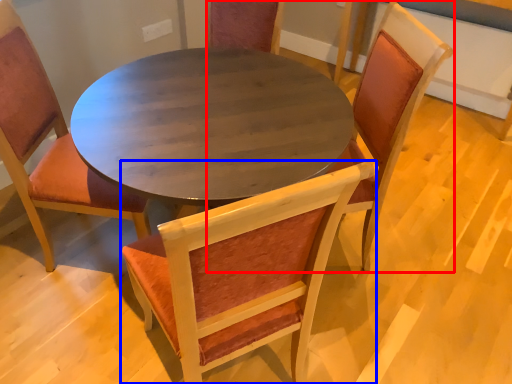
Question: Which of the following is the closest to the observer, chair (highlighted by a red box) or chair (highlighted by a blue box)?

Choices:
 (A) chair
 (B) chair

Answer: (B)